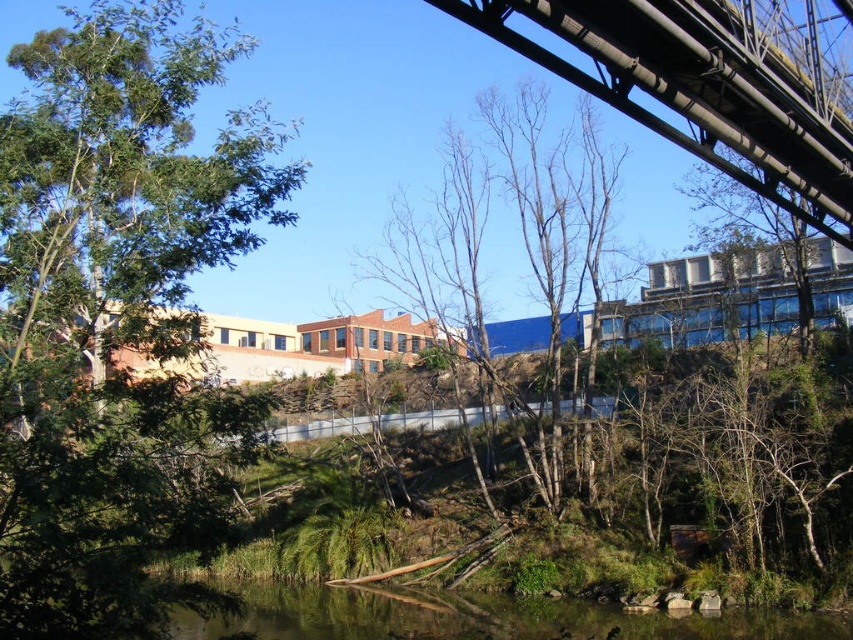
Question: Which point is closer to the camera taking this photo?

Choices:
 (A) [836, 161]
 (B) [236, 170]

Answer: (B)

Question: Where is green leafy tree at upper left located in relation to black metal bridge at upper right in the image?

Choices:
 (A) right
 (B) left

Answer: (B)

Question: Is the position of green leafy tree at upper left less distant than that of black metal bridge at upper right?

Choices:
 (A) yes
 (B) no

Answer: (A)

Question: Which point is closer to the camera?

Choices:
 (A) (746, 72)
 (B) (196, 636)

Answer: (A)

Question: Can you confirm if black metal bridge at upper right is bigger than clear water at lower center?

Choices:
 (A) no
 (B) yes

Answer: (A)

Question: Which of the following is the farthest from the observer?

Choices:
 (A) bare branches at center
 (B) black metal bridge at upper right

Answer: (A)